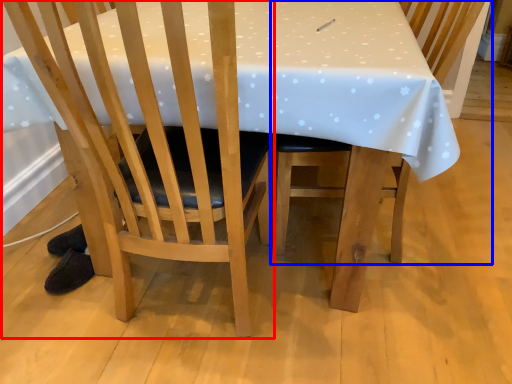
Question: Which of the following is the closest to the observer, chair (highlighted by a red box) or chair (highlighted by a blue box)?

Choices:
 (A) chair
 (B) chair

Answer: (A)